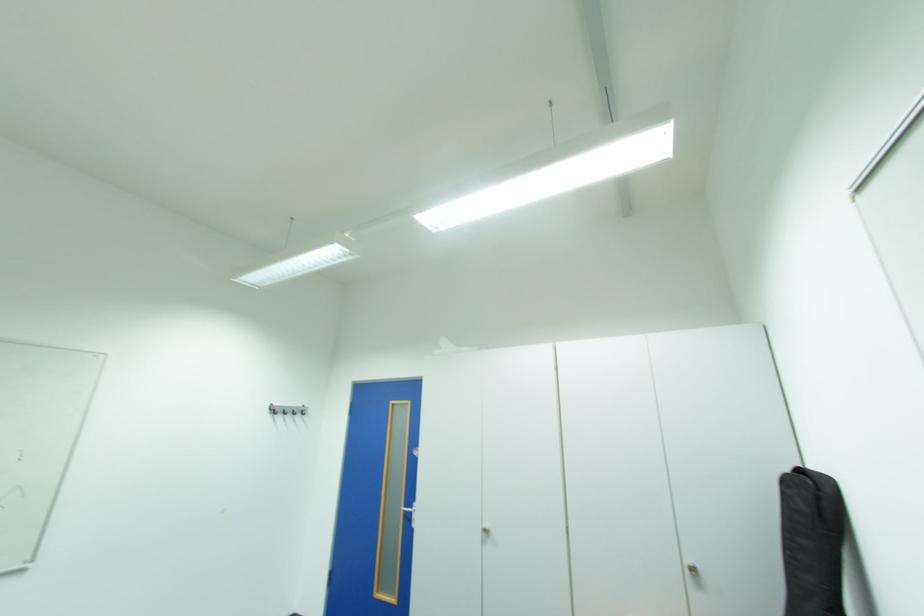
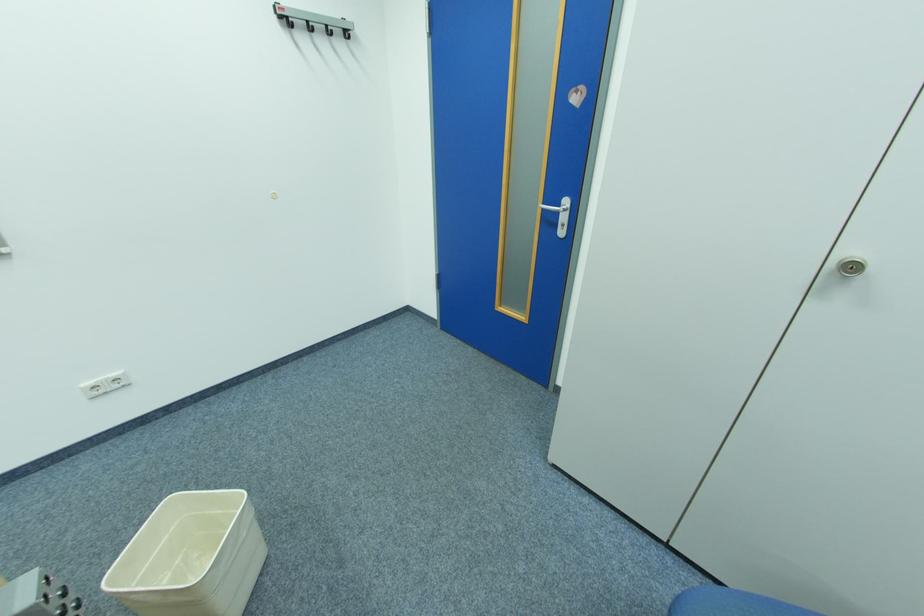
Find the pixel in the second image that matches point (414, 511) in the first image.

(552, 209)